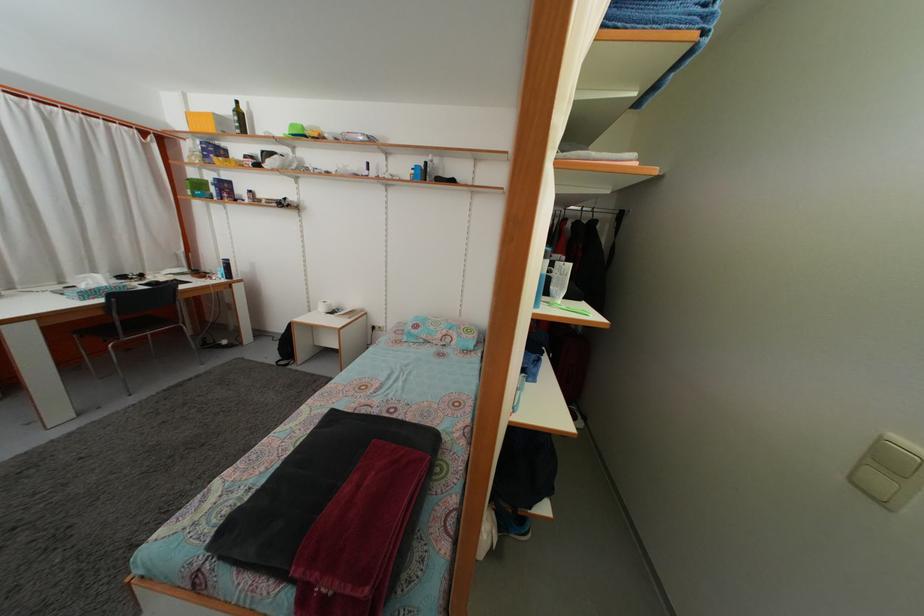
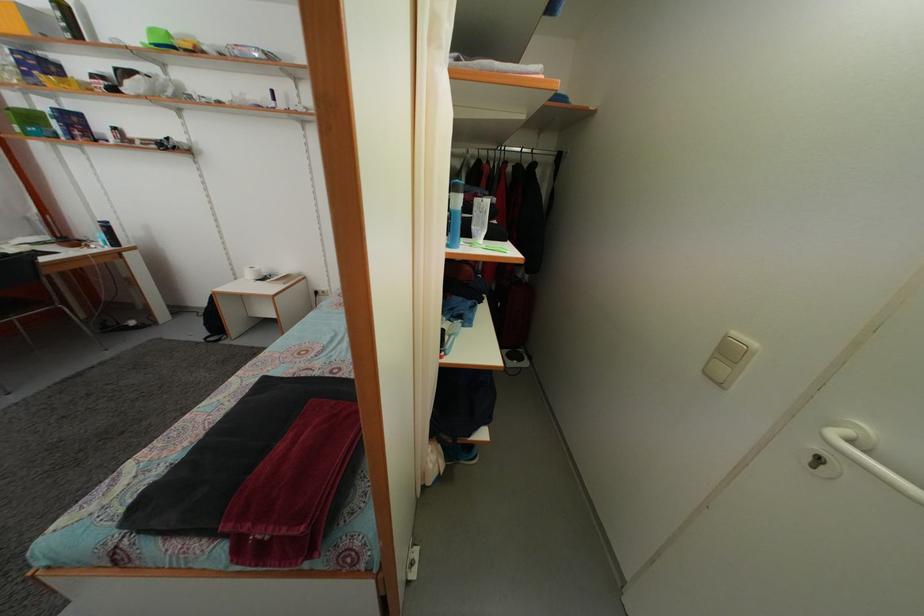
Question: Based on the continuous images, in which direction is the camera rotating? Reply with the corresponding letter.

Choices:
 (A) Left
 (B) Right
 (C) Up
 (D) Down

Answer: (D)